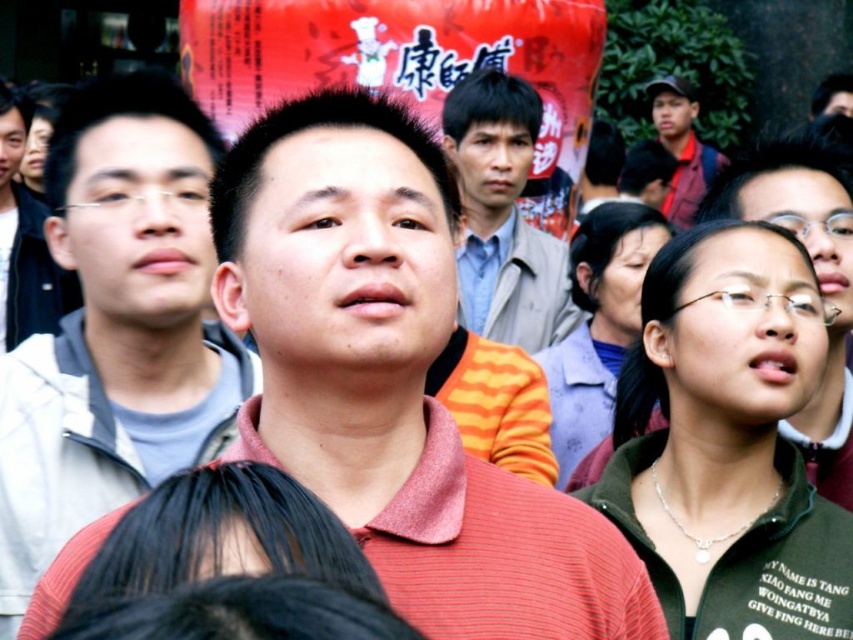
Between light brown leather jacket at center and matte gray shirt at left, which one appears on the right side from the viewer's perspective?

Positioned to the right is light brown leather jacket at center.

Measure the distance from light brown leather jacket at center to matte gray shirt at left.

They are 20.86 meters apart.

Is point (486, 304) positioned in front of point (22, 97)?

Yes.

This screenshot has height=640, width=853. What are the coordinates of `light brown leather jacket at center` in the screenshot? It's located at (503, 216).

Between matte gray shirt at left and dark blue shirt at upper right, which one has more height?

Standing taller between the two is matte gray shirt at left.

Which is behind, point (53, 305) or point (712, 172)?

The point (712, 172) is behind.

Which is behind, point (22, 292) or point (680, 166)?

Point (680, 166)

Find the location of a particular element. The width and height of the screenshot is (853, 640). matte gray shirt at left is located at coordinates (25, 237).

Between light brown leather jacket at center and blue cotton shirt at center, which one is positioned lower?

blue cotton shirt at center is lower down.

Can you confirm if light brown leather jacket at center is smaller than blue cotton shirt at center?

No, light brown leather jacket at center is not smaller than blue cotton shirt at center.

Which is in front, point (450, 106) or point (514, 216)?

Point (450, 106) is more forward.

You are a GUI agent. You are given a task and a screenshot of the screen. Output one action in this format:
    pyautogui.click(x=<x>, y=<y>)
    Task: Click on the light brown leather jacket at center
    Image resolution: width=853 pixels, height=640 pixels.
    Given the screenshot: What is the action you would take?
    pyautogui.click(x=503, y=216)